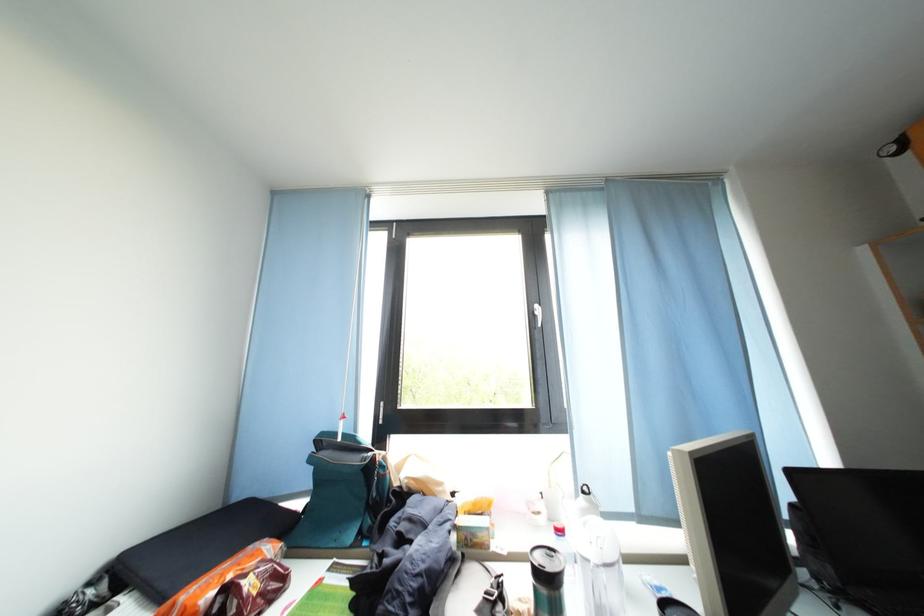
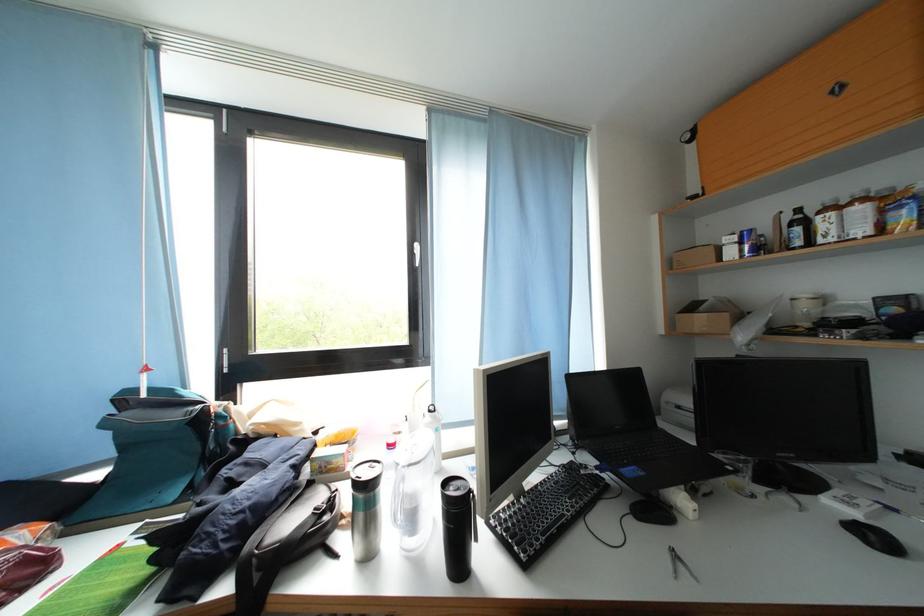
Where in the second image is the point corresponding to (344,440) from the first image?

(142, 397)